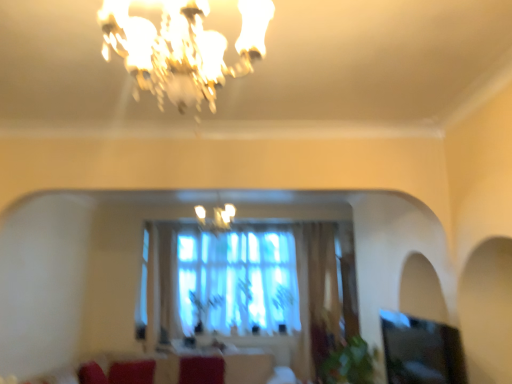
Question: Does wooden round table at center have a greater height compared to velvet red couch at lower center?

Choices:
 (A) yes
 (B) no

Answer: (B)

Question: Does wooden round table at center turn towards velvet red couch at lower center?

Choices:
 (A) yes
 (B) no

Answer: (A)

Question: From a real-world perspective, is wooden round table at center located beneath velvet red couch at lower center?

Choices:
 (A) yes
 (B) no

Answer: (B)

Question: Would you say wooden round table at center contains velvet red couch at lower center?

Choices:
 (A) yes
 (B) no

Answer: (B)

Question: Is wooden round table at center looking in the opposite direction of velvet red couch at lower center?

Choices:
 (A) yes
 (B) no

Answer: (B)

Question: Is point (250, 360) positioned closer to the camera than point (184, 375)?

Choices:
 (A) farther
 (B) closer

Answer: (A)

Question: Choose the correct answer: Is velvet red couch at lower center inside velvet maroon swivel chair at center or outside it?

Choices:
 (A) outside
 (B) inside

Answer: (A)

Question: Considering their positions, is velvet red couch at lower center located in front of or behind velvet maroon swivel chair at center?

Choices:
 (A) front
 (B) behind

Answer: (A)

Question: Looking at the image, does velvet red couch at lower center seem bigger or smaller compared to velvet maroon swivel chair at center?

Choices:
 (A) small
 (B) big

Answer: (B)

Question: From the image's perspective, is gold crystal chandelier at upper center, which appears as the second lamp when ordered from the bottom, above or below velvet maroon swivel chair at center?

Choices:
 (A) below
 (B) above

Answer: (B)

Question: Would you say gold crystal chandelier at upper center, marked as the second lamp in a back-to-front arrangement, is to the left or to the right of velvet maroon swivel chair at center in the picture?

Choices:
 (A) left
 (B) right

Answer: (B)

Question: In terms of height, does gold crystal chandelier at upper center, which is the 1th lamp from top to bottom, look taller or shorter compared to velvet maroon swivel chair at center?

Choices:
 (A) short
 (B) tall

Answer: (B)

Question: Considering the positions of gold crystal chandelier at upper center, which appears as the second lamp when ordered from the bottom, and velvet maroon swivel chair at center in the image, is gold crystal chandelier at upper center, which appears as the second lamp when ordered from the bottom, wider or thinner than velvet maroon swivel chair at center?

Choices:
 (A) wide
 (B) thin

Answer: (A)

Question: From a real-world perspective, relative to wooden round table at center, is transparent glass window screen at lower right vertically above or below?

Choices:
 (A) above
 (B) below

Answer: (A)

Question: Is transparent glass window screen at lower right taller or shorter than wooden round table at center?

Choices:
 (A) tall
 (B) short

Answer: (A)